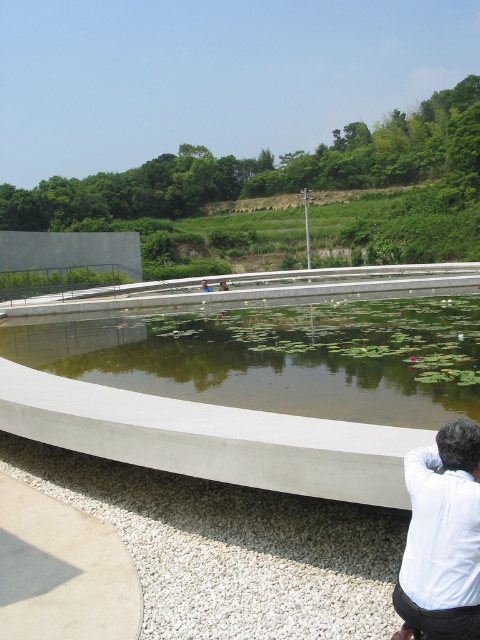
You are standing at the point marked as point [279,356] in the image. What object is located exactly at that point?

The green concrete pond at center is located exactly at point [279,356].

You are a photographer trying to capture the entire green concrete pond at center and the white matte shirt at lower right in one frame. Based on their sizes in the image, which object should you focus on first to ensure both are in the frame?

The green concrete pond at center is larger than the white matte shirt at lower right, so you should focus on the green concrete pond at center first to ensure both are in the frame.